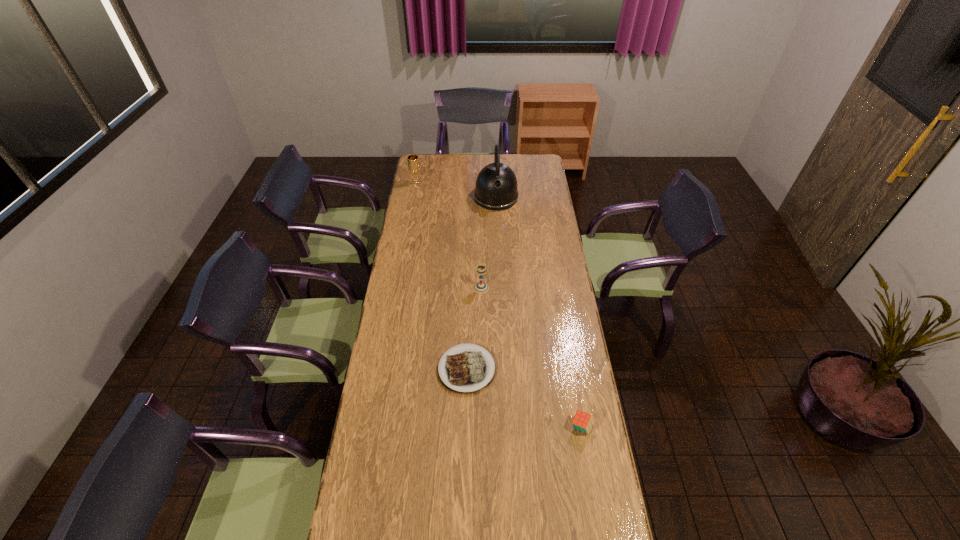
In order to click on unoccupied area between the fourth shortest object and the nearer chalice in this screenshot , I will do `click(448, 235)`.

This screenshot has width=960, height=540. Find the location of `free space between the shortest object and the rightmost object`. free space between the shortest object and the rightmost object is located at coordinates (524, 398).

Identify the location of free space between the second shortest object and the fourth shortest object. The height and width of the screenshot is (540, 960). (498, 305).

This screenshot has width=960, height=540. I want to click on vacant space that is in between the second tallest object and the shortest object, so click(x=442, y=276).

Locate an element on the screen. Image resolution: width=960 pixels, height=540 pixels. vacant region between the second nearest object and the nearer chalice is located at coordinates (474, 328).

Find the location of a particular element. The height and width of the screenshot is (540, 960). empty space that is in between the right chalice and the fourth tallest object is located at coordinates (531, 357).

This screenshot has height=540, width=960. I want to click on empty space between the nearer chalice and the fourth tallest object, so click(531, 357).

Select which object is the third closest to the leftmost object. Please provide its 2D coordinates. Your answer should be formatted as a tuple, i.e. [(x, y)], where the tuple contains the x and y coordinates of a point satisfying the conditions above.

[(468, 369)]

This screenshot has width=960, height=540. What are the coordinates of `object that is the closest to the shortest object` in the screenshot? It's located at tap(582, 421).

Locate an element on the screen. free space that satisfies the following two spatial constraints: 1. on the front side of the second tallest object; 2. on the right side of the shorter chalice is located at coordinates (397, 288).